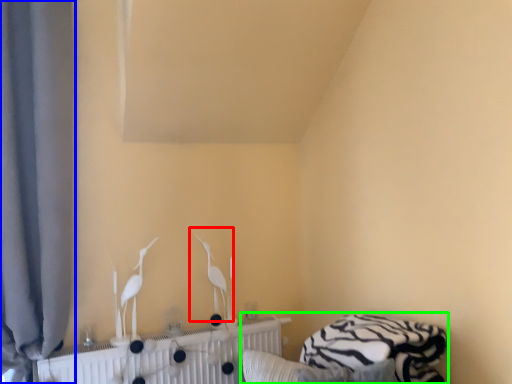
Question: Considering the real-world distances, which object is farthest from bird (highlighted by a red box)? curtain (highlighted by a blue box) or bed (highlighted by a green box)?

Choices:
 (A) curtain
 (B) bed

Answer: (A)